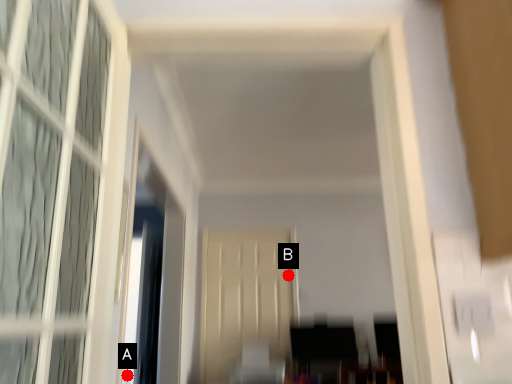
Question: Two points are circled on the image, labeled by A and B beside each circle. Among these points, which one is farthest from the camera?

Choices:
 (A) A is further
 (B) B is further

Answer: (B)